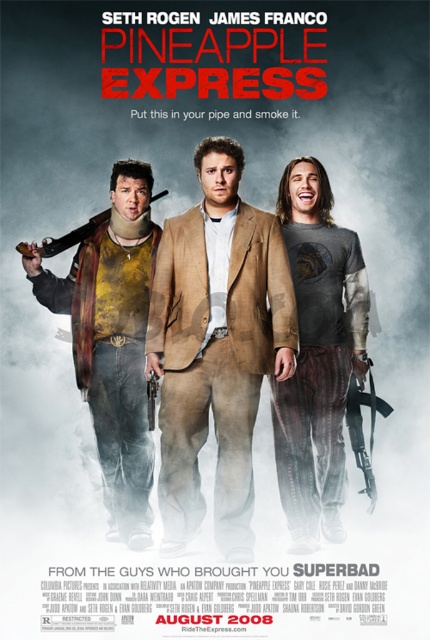
Question: Which object is positioned farthest from the black plastic gun at center?

Choices:
 (A) matte brown gun at left
 (B) brushed metal jacket at left

Answer: (A)

Question: Does brown textured suit at center appear on the right side of matte brown gun at left?

Choices:
 (A) yes
 (B) no

Answer: (A)

Question: Which of the following is the closest to the observer?

Choices:
 (A) black plastic gun at center
 (B) brushed metal jacket at left
 (C) gray cotton t-shirt at center
 (D) brown textured suit at center

Answer: (D)

Question: Which point is farther from the camera taking this photo?

Choices:
 (A) (101, 248)
 (B) (362, 449)
 (C) (199, 403)

Answer: (A)

Question: Can you confirm if brushed metal jacket at left is positioned to the right of black plastic gun at center?

Choices:
 (A) yes
 (B) no

Answer: (B)

Question: Does brown textured suit at center have a larger size compared to brushed metal jacket at left?

Choices:
 (A) yes
 (B) no

Answer: (A)